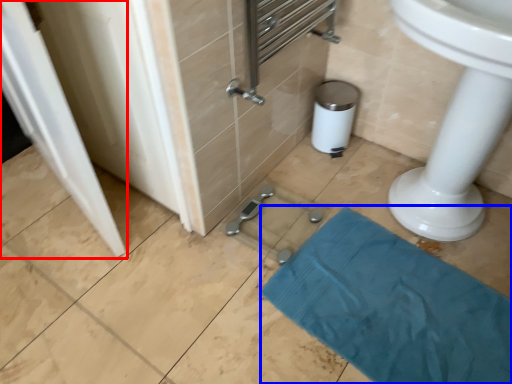
Question: Which point is further to the camera, screen door (highlighted by a red box) or bath towel (highlighted by a blue box)?

Choices:
 (A) screen door
 (B) bath towel

Answer: (B)